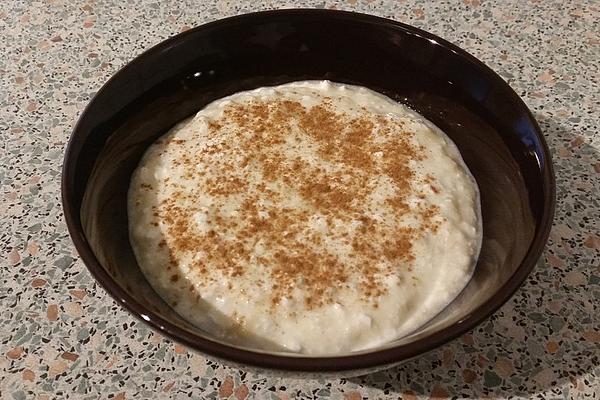
Where is `countertop top left of bowl`? countertop top left of bowl is located at coordinates (49, 42).